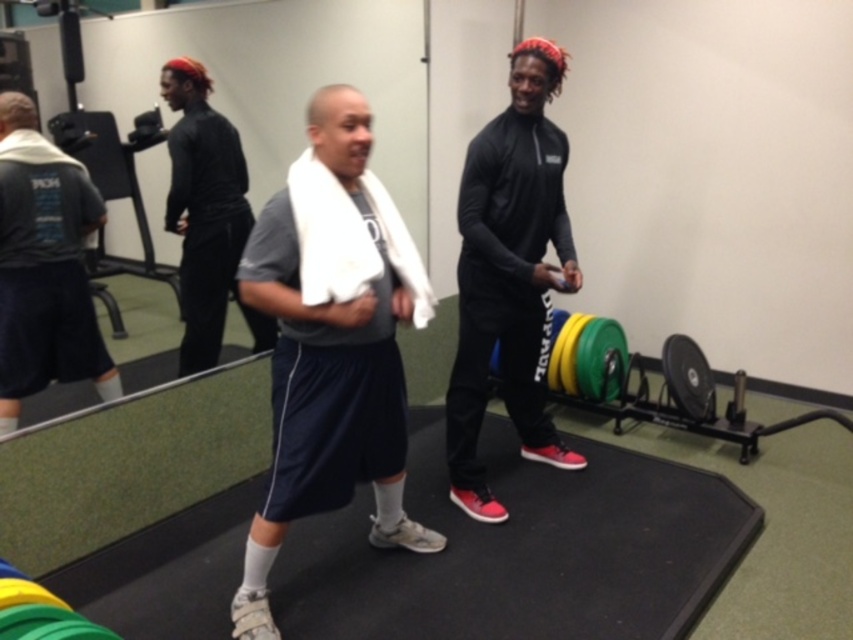
You are a photographer setting up a shoot in the gym. You need to position a light source so that it illuminates both the black matte athletic wear at center and the black matte shirt at center without casting shadows. Based on their positions, which object should be placed closer to the light source to avoid shadows?

The black matte athletic wear at center is below the black matte shirt at center, so placing the light source above them would require the black matte shirt at center to be closer to the light source to avoid shadows.

You are a photographer setting up for a group photo. You notice the white fabric towel at center and the black matte shirt at center. Which object should you adjust to ensure both are fully visible in the photo?

The white fabric towel at center is in front of the black matte shirt at center. To ensure both are fully visible, you should adjust the position of the white fabric towel at center so it does not block the view of the black matte shirt at center.